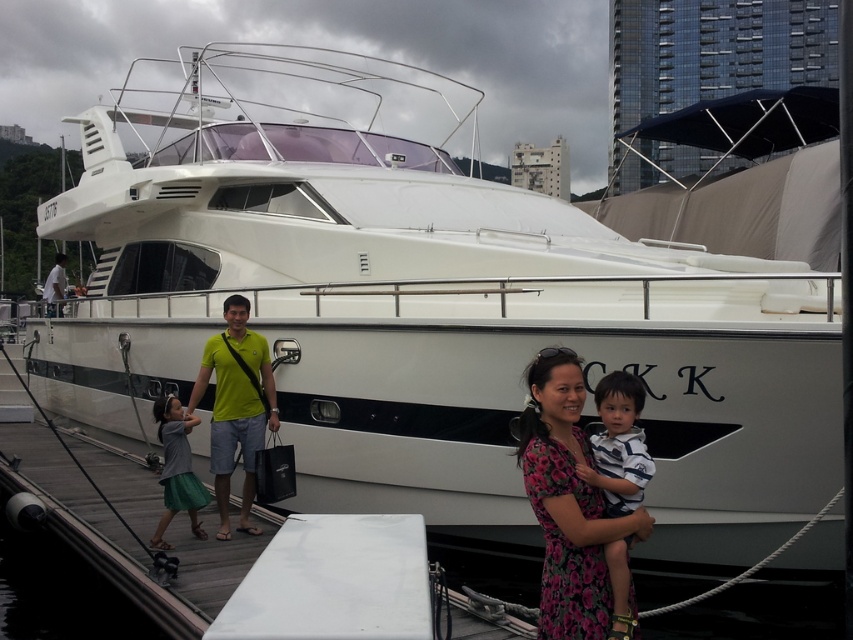
You are organizing a charity event and need to decide which clothing item to display first. Based on their sizes, which of the two items, the floral fabric dress at center or the striped cotton shirt at center, should be placed in the spotlight first?

The floral fabric dress at center has a larger size compared to the striped cotton shirt at center, so it should be placed in the spotlight first due to its bigger size.

You are a photographer trying to capture a group photo of the two adults and two children by the yacht. The adults are wearing a floral fabric dress at center and a striped cotton shirt at center. Since you want to ensure both adults are fully visible in the photo, which adult should stand closer to the front to avoid being blocked by the other?

The striped cotton shirt at center should stand closer to the front because the floral fabric dress at center is much taller, so placing the shorter adult in front prevents them from being blocked by the taller adult.